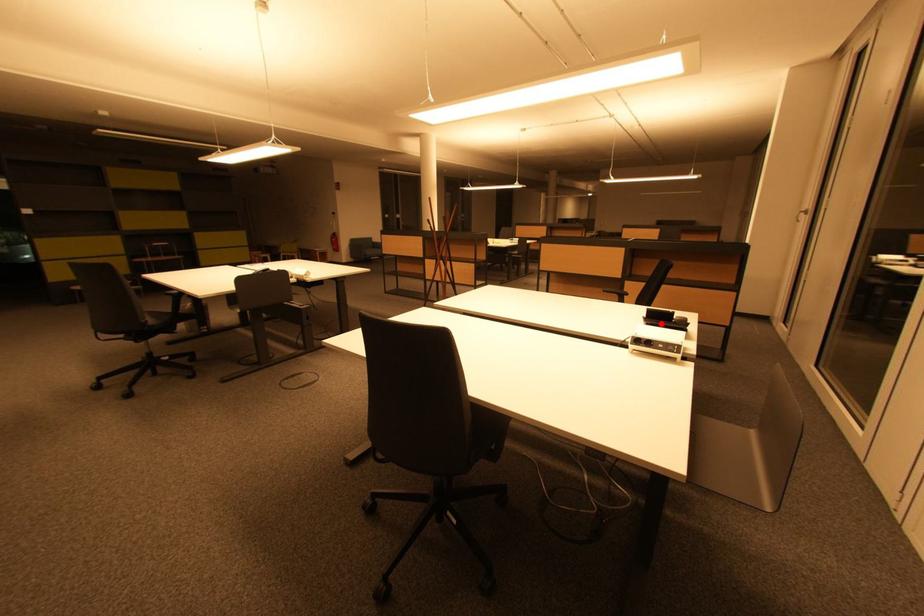
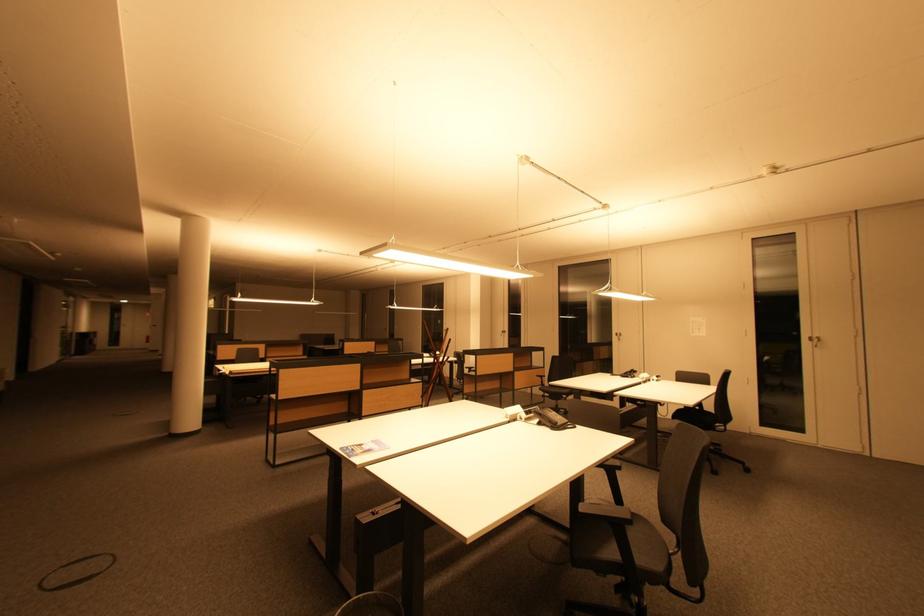
Question: I am providing you with two images of the same scene from different viewpoints. A red point is marked on the first image. Can you still see the location of the red point in image 2?

Choices:
 (A) Yes
 (B) No

Answer: (B)